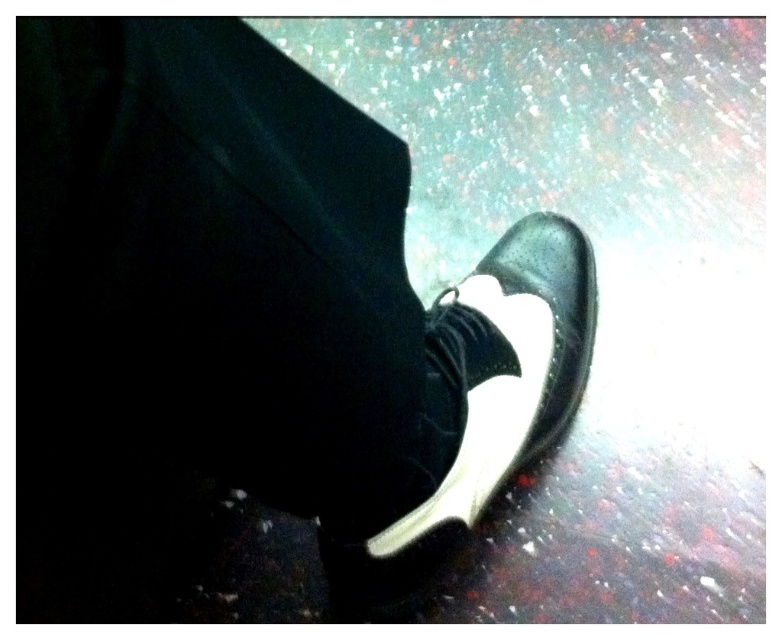
Can you confirm if black leather shoe at lower right is positioned above matte black shoe at center?

Incorrect, black leather shoe at lower right is not positioned above matte black shoe at center.

Can you confirm if black leather shoe at lower right is bigger than matte black shoe at center?

Indeed, black leather shoe at lower right has a larger size compared to matte black shoe at center.

Between point (228, 333) and point (551, 236), which one is positioned behind?

The point (551, 236) is more distant.

I want to click on black leather shoe at lower right, so click(253, 323).